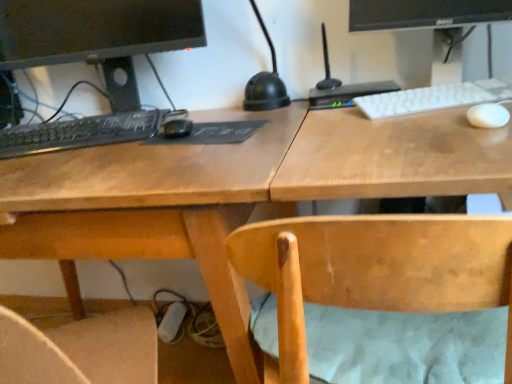
This screenshot has height=384, width=512. I want to click on vacant space behind white matte mouse at upper right, so click(441, 103).